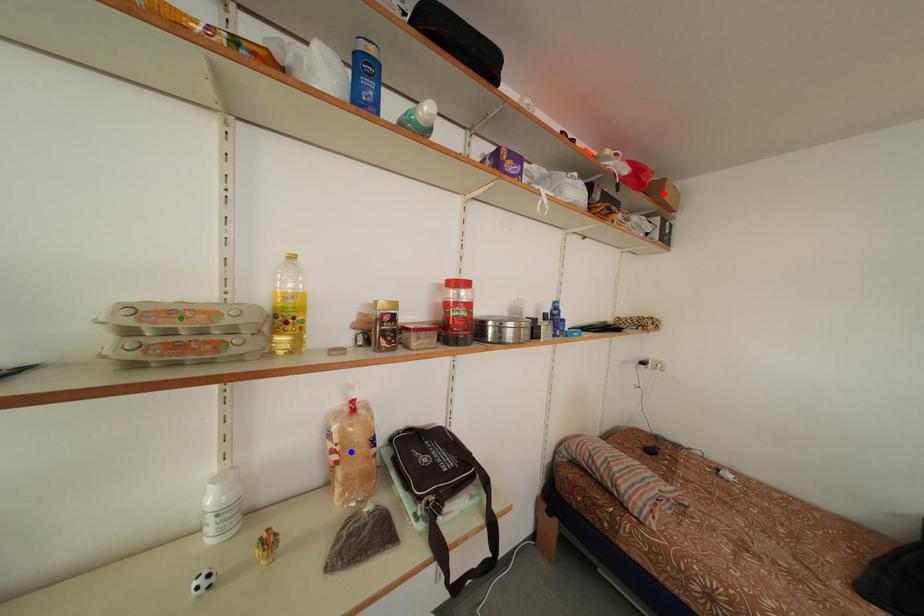
Order these from nearest to farthest:
- green point
- blue point
- red point

green point < blue point < red point